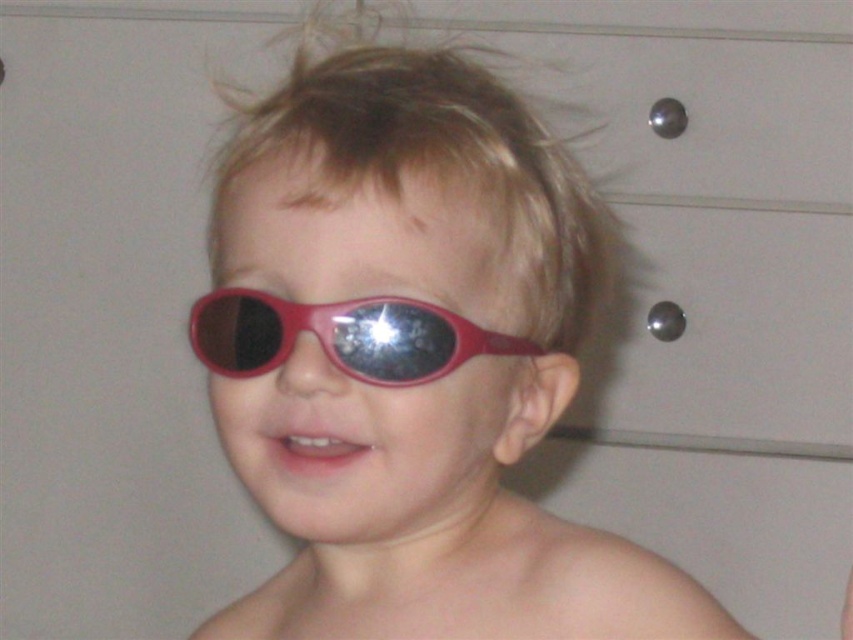
Question: Can you confirm if matte plastic sunglasses at center is positioned to the left of shiny plastic goggles at center?

Choices:
 (A) no
 (B) yes

Answer: (A)

Question: Does matte plastic sunglasses at center appear under shiny plastic goggles at center?

Choices:
 (A) yes
 (B) no

Answer: (A)

Question: Is matte plastic sunglasses at center above shiny plastic goggles at center?

Choices:
 (A) yes
 (B) no

Answer: (B)

Question: Which point appears farthest from the camera in this image?

Choices:
 (A) (492, 332)
 (B) (631, 580)

Answer: (B)